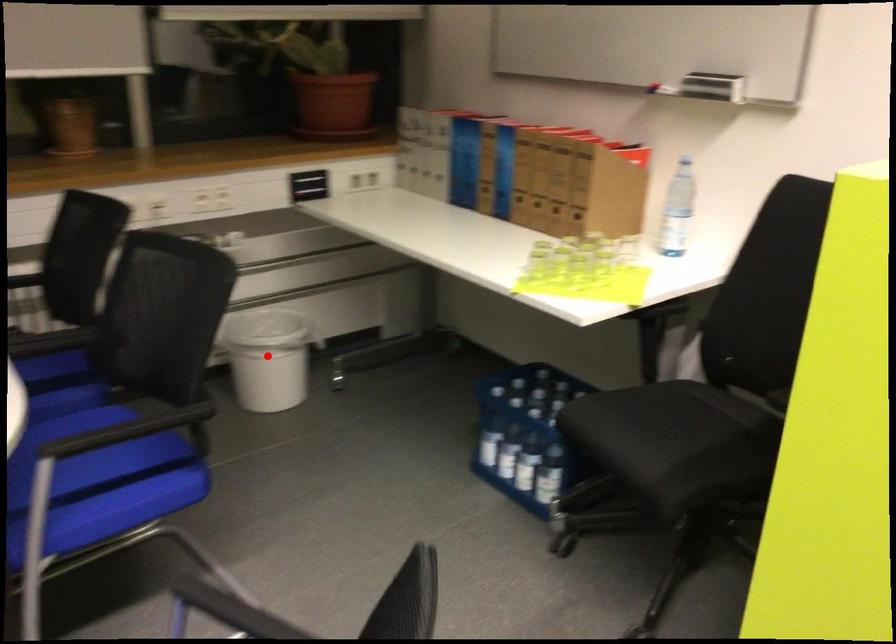
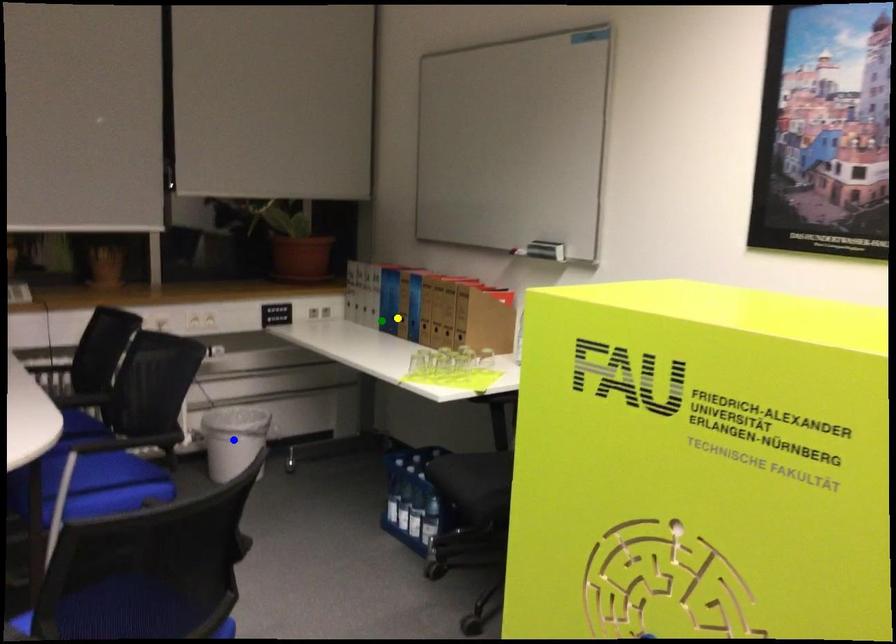
Question: I am providing you with two images of the same scene from different viewpoints. A red point is marked on the first image. You are given multiple points on the second image. Which spot in image 2 lines up with the point in image 1?

Choices:
 (A) green point
 (B) blue point
 (C) yellow point

Answer: (B)